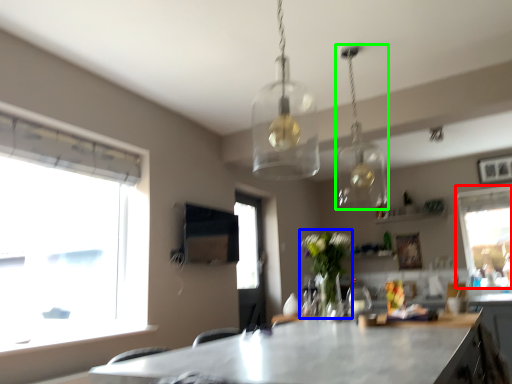
Question: Which object is the closest to the window (highlighted by a red box)? Choose among these: plant (highlighted by a blue box) or lamp (highlighted by a green box).

Choices:
 (A) plant
 (B) lamp

Answer: (B)